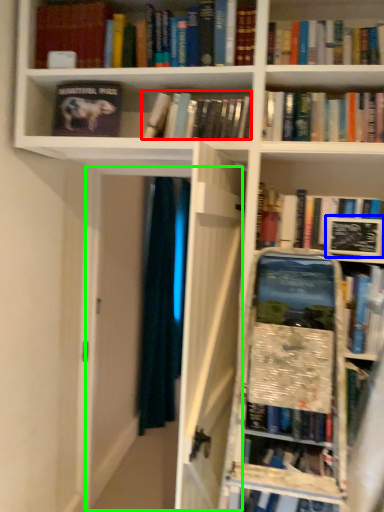
Question: Which object is positioned farthest from book (highlighted by a red box)? Select from paperback book (highlighted by a blue box) and glass door (highlighted by a green box).

Choices:
 (A) paperback book
 (B) glass door

Answer: (B)